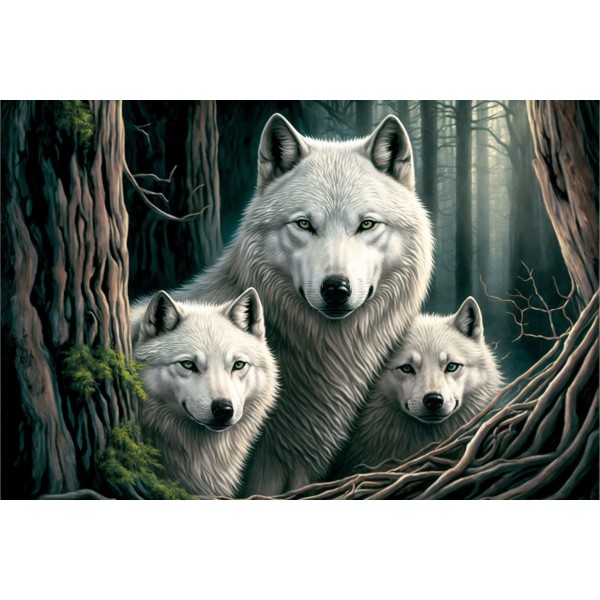
Find the location of a particular element. white fur is located at coordinates (321, 372).